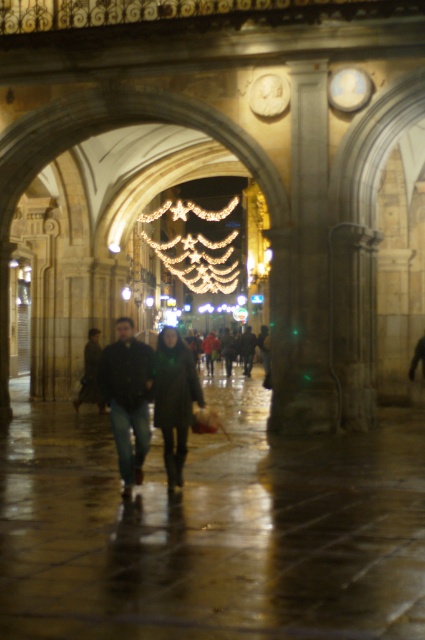
You are a photographer standing in the arched passageway. You notice two items at the center of the scene, the dark blue jeans at center and the black matte coat at center. Which item appears taller in the image?

The black matte coat at center appears taller than the dark blue jeans at center in the image.

You are a delivery person who needs to place a package between the dark green leather jacket at center and the black matte coat at center. Considering their heights, which object should you place the package closer to?

The dark green leather jacket at center is much taller than the black matte coat at center, so you should place the package closer to the dark green leather jacket at center to ensure stability and prevent it from falling over.